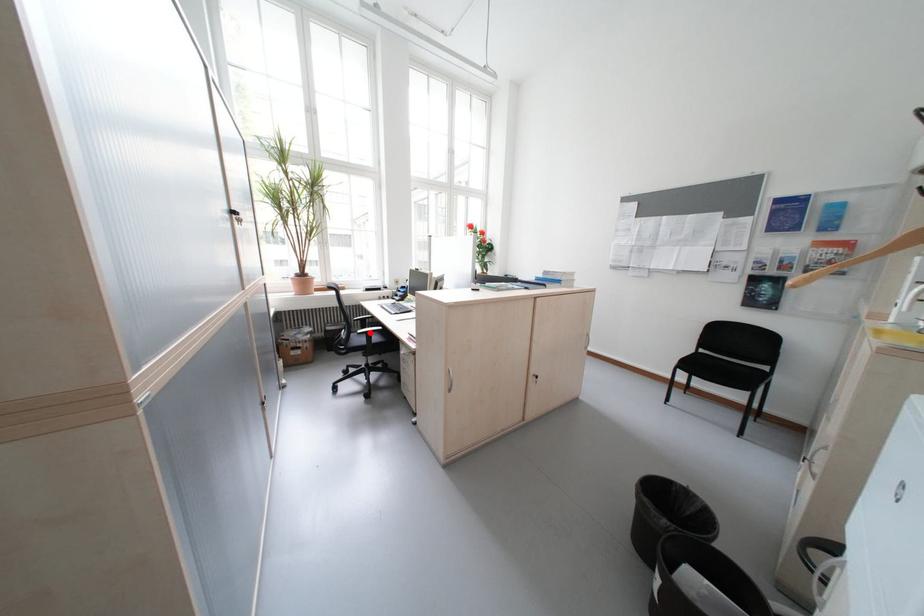
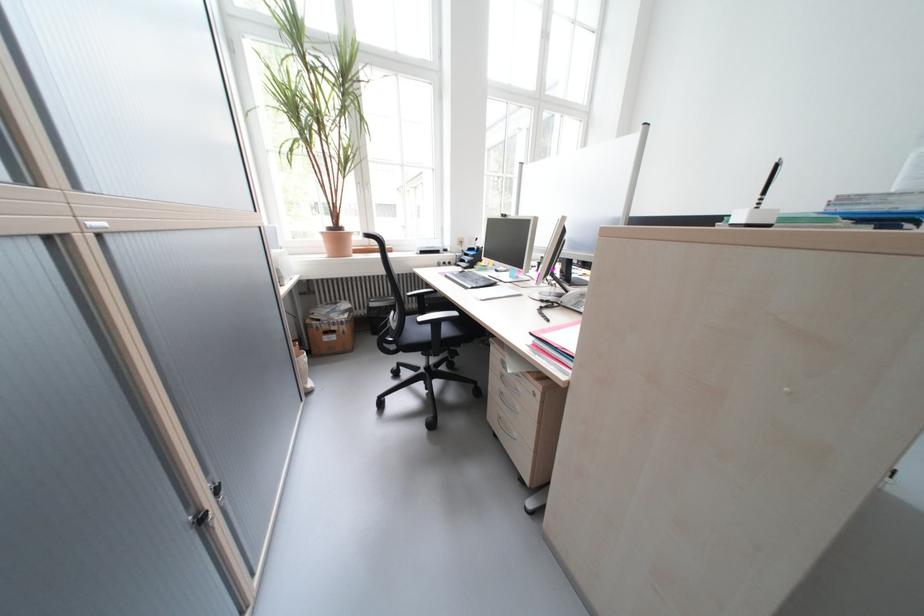
Locate, in the second image, the point that corresponds to the highlighted location in the first image.

(431, 320)